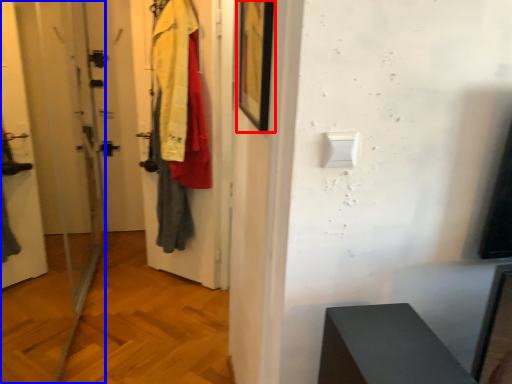
Question: Which object appears closest to the camera in this image, picture frame (highlighted by a red box) or screen door (highlighted by a blue box)?

Choices:
 (A) picture frame
 (B) screen door

Answer: (B)